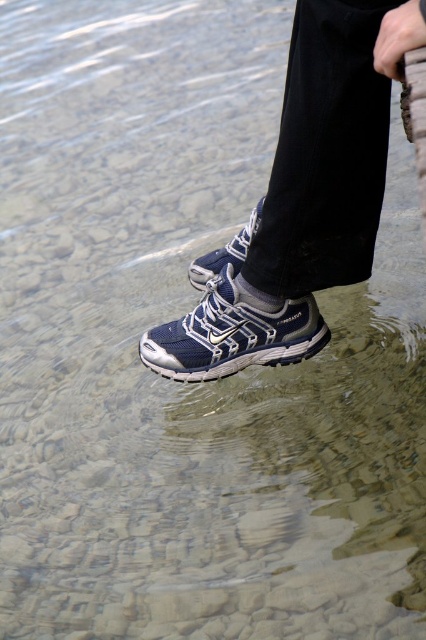
Is point (155, 365) positioned before point (207, 275)?

That is True.

Is navy mesh shoe at center thinner than blue mesh shoe at center?

No, navy mesh shoe at center is not thinner than blue mesh shoe at center.

Image resolution: width=426 pixels, height=640 pixels. Find the location of `navy mesh shoe at center`. navy mesh shoe at center is located at coordinates (233, 333).

The image size is (426, 640). In order to click on navy mesh shoe at center in this screenshot , I will do `click(233, 333)`.

Can you confirm if matte blue mesh shoe at center is wider than navy mesh shoe at center?

Indeed, matte blue mesh shoe at center has a greater width compared to navy mesh shoe at center.

Can you confirm if matte blue mesh shoe at center is positioned to the right of navy mesh shoe at center?

Indeed, matte blue mesh shoe at center is positioned on the right side of navy mesh shoe at center.

In the scene shown: Measure the distance between matte blue mesh shoe at center and camera.

99.81 centimeters

Where is `matte blue mesh shoe at center`? Image resolution: width=426 pixels, height=640 pixels. matte blue mesh shoe at center is located at coordinates (302, 198).

Is matte blue mesh shoe at center to the left of blue mesh shoe at center from the viewer's perspective?

Incorrect, matte blue mesh shoe at center is not on the left side of blue mesh shoe at center.

Is matte blue mesh shoe at center shorter than blue mesh shoe at center?

No.

Is point (322, 259) farther from viewer compared to point (247, 241)?

That is False.

The width and height of the screenshot is (426, 640). I want to click on matte blue mesh shoe at center, so click(302, 198).